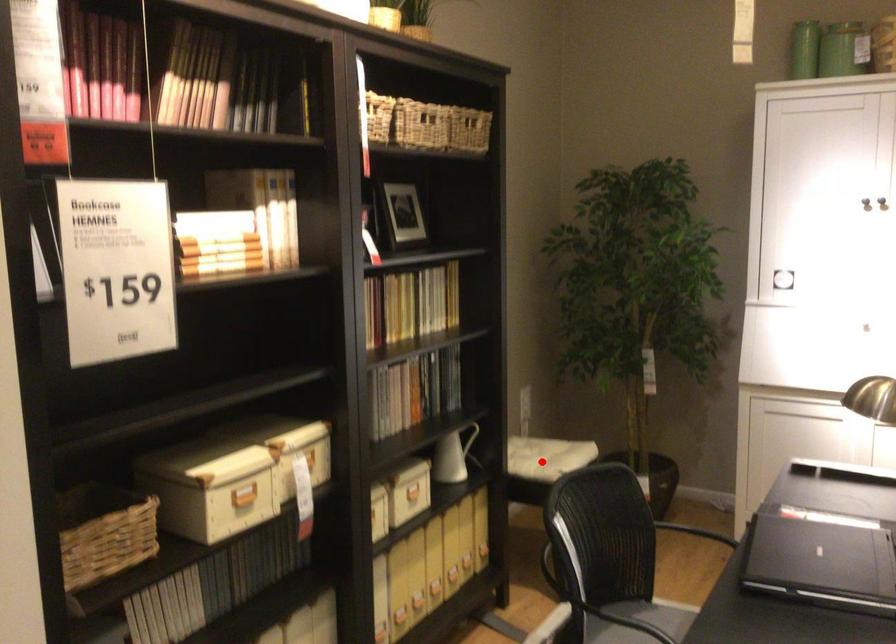
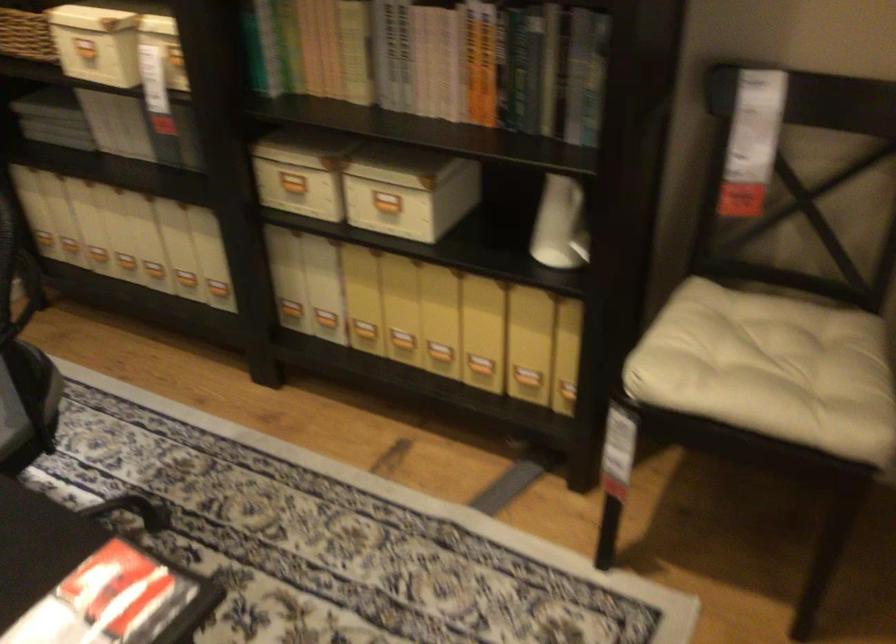
The point at the highlighted location is marked in the first image. Where is the corresponding point in the second image?

(776, 366)